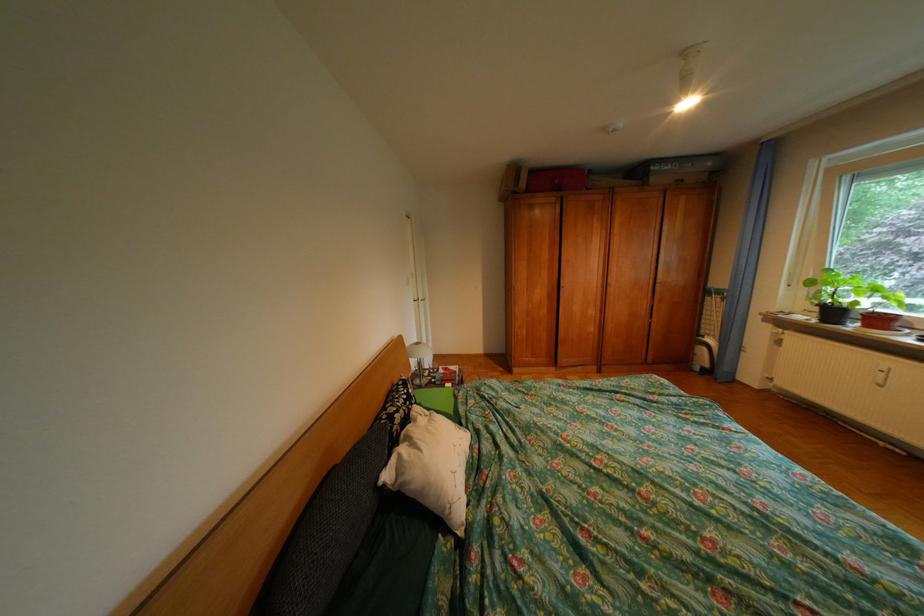
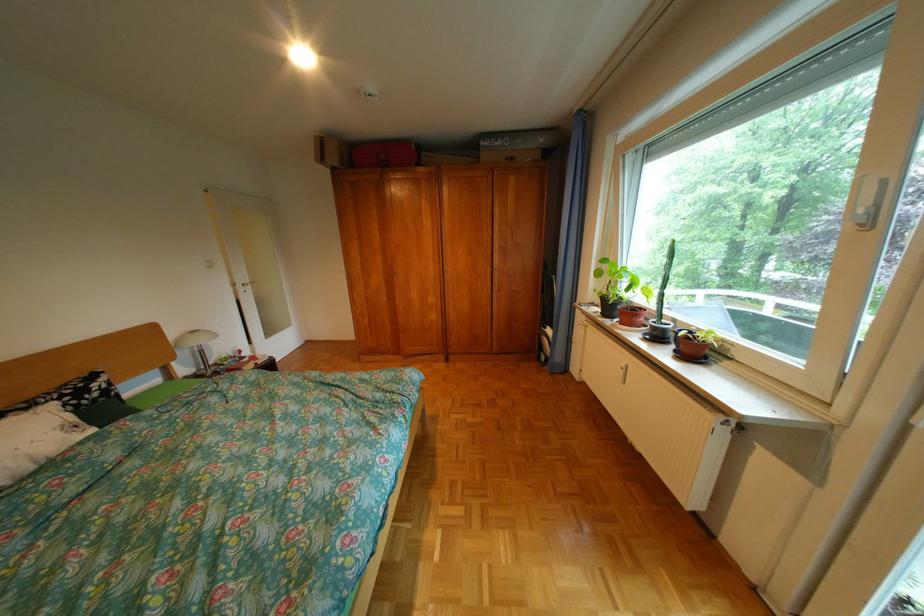
Find the pixel in the second image that matches pixel 555 294 in the first image.

(392, 280)